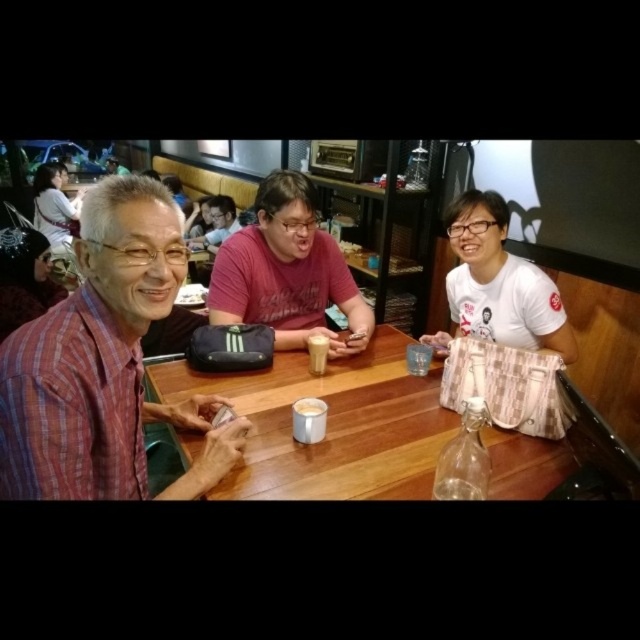
Which is above, wooden table at center or white cotton shirt at center?

Positioned higher is white cotton shirt at center.

In the scene shown: Who is more distant from viewer, (186, 456) or (532, 301)?

Point (532, 301)

This screenshot has width=640, height=640. I want to click on wooden table at center, so click(330, 424).

Between white fabric shirt at upper left and white frothy foam at center, which one is positioned lower?

white frothy foam at center

Can you confirm if white fabric shirt at upper left is wider than white frothy foam at center?

Correct, the width of white fabric shirt at upper left exceeds that of white frothy foam at center.

Between point (54, 241) and point (317, 410), which one is positioned behind?

The point (54, 241) is behind.

Find the location of a particular element. The width and height of the screenshot is (640, 640). white fabric shirt at upper left is located at coordinates (52, 208).

Which of these two, white cotton shirt at center or white matte paper at upper center, stands taller?

Standing taller between the two is white cotton shirt at center.

Who is more forward, (506, 260) or (192, 291)?

Point (506, 260)

The height and width of the screenshot is (640, 640). Identify the location of white cotton shirt at center. (499, 282).